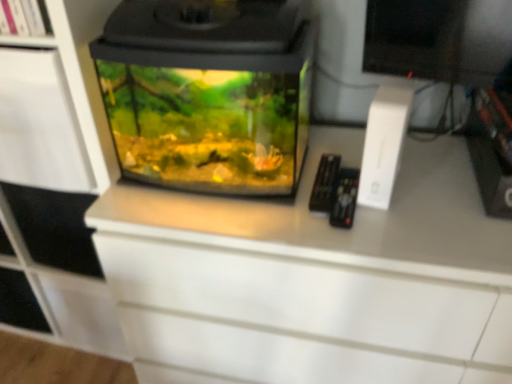
Question: From their relative heights in the image, would you say transparent glass aquarium at center is taller or shorter than white matte cabinet at left?

Choices:
 (A) tall
 (B) short

Answer: (B)

Question: Which is correct: transparent glass aquarium at center is inside white matte cabinet at left, or outside of it?

Choices:
 (A) inside
 (B) outside

Answer: (B)

Question: Which object is the farthest from the white matte shelf at upper left?

Choices:
 (A) transparent glass aquarium at center
 (B) white matte cabinet at left

Answer: (A)

Question: Considering the real-world distances, which object is farthest from the white matte shelf at upper left?

Choices:
 (A) transparent glass aquarium at center
 (B) white matte cabinet at left

Answer: (A)